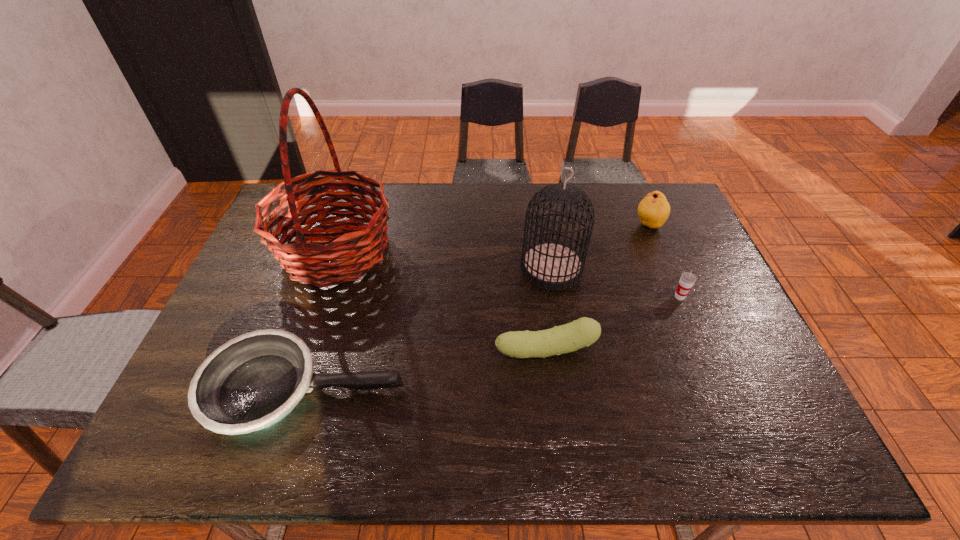
Where is `object at the near left corner`? The height and width of the screenshot is (540, 960). object at the near left corner is located at coordinates (253, 381).

This screenshot has width=960, height=540. I want to click on object present at the far right corner, so click(x=654, y=209).

The width and height of the screenshot is (960, 540). In the image, there is a desktop. In order to click on vacant space at the far edge in this screenshot , I will do `click(427, 185)`.

Where is `vacant area at the left edge of the desktop`? vacant area at the left edge of the desktop is located at coordinates (278, 321).

Locate an element on the screen. vacant space at the near right corner of the desktop is located at coordinates (750, 424).

Find the location of a particular element. The height and width of the screenshot is (540, 960). vacant space that's between the birdcage and the cucumber is located at coordinates click(549, 309).

Identify the location of vacant area between the frying pan and the basket. This screenshot has width=960, height=540. (321, 320).

The image size is (960, 540). Find the location of `vacant point located between the birdcage and the cucumber`. vacant point located between the birdcage and the cucumber is located at coordinates (549, 309).

The width and height of the screenshot is (960, 540). Identify the location of vacant area that lies between the pear and the basket. (492, 238).

Locate an element on the screen. Image resolution: width=960 pixels, height=540 pixels. vacant region between the birdcage and the basket is located at coordinates (444, 260).